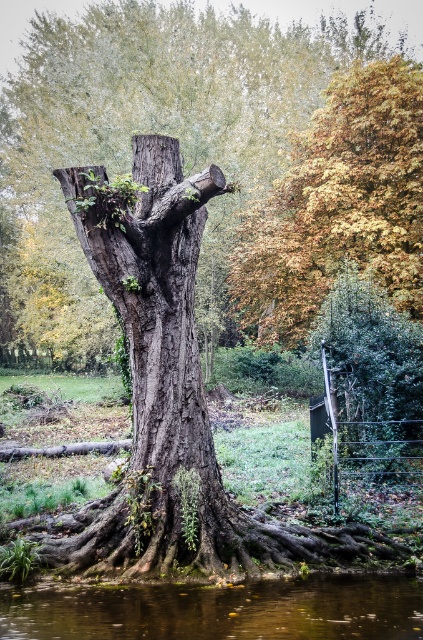
You are a photographer standing at a certain distance from the gray rough bark tree trunk at center. You want to take a photo that captures the entire tree trunk in the frame without zooming in. Considering your camera has a maximum focus range of 15 meters, will you be able to capture the tree trunk clearly?

The gray rough bark tree trunk at center is 16.67 meters away from the camera, which exceeds the camera maximum focus range of 15 meters. Therefore, you cannot capture the tree trunk clearly without zooming in.

You are a photographer standing at the edge of the brown reflective water at lower center, aiming to capture the gray rough bark tree trunk at center in your shot. Based on their positions, will the tree trunk appear reflected in the water?

The gray rough bark tree trunk at center is positioned over brown reflective water at lower center, so yes, the tree trunk will be reflected in the water since it is directly above the reflective surface.